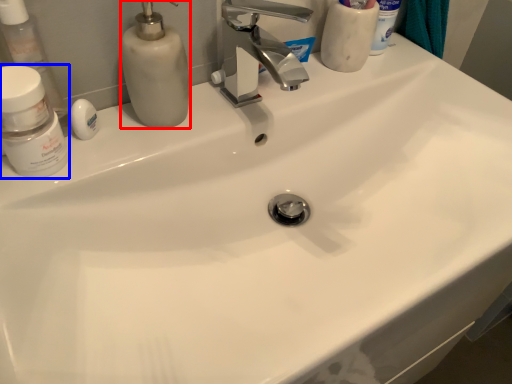
Question: Which of the following is the closest to the observer, soap dispenser (highlighted by a red box) or mouthwash (highlighted by a blue box)?

Choices:
 (A) soap dispenser
 (B) mouthwash

Answer: (B)